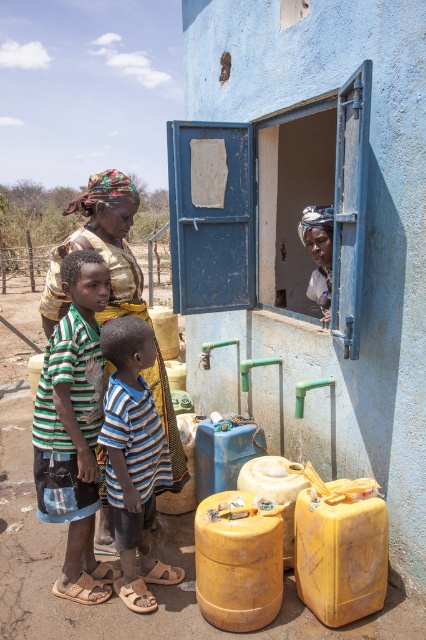
You are standing at the center of the image and want to locate the striped fabric shirt at lower left. In which direction should you look to find it?

The striped fabric shirt at lower left is located at coordinates (134, 458), so you should look to the lower left direction to find it.

You are a tailor observing two shirts in a shop window. The shirts are labeled as the striped cotton shirt at center and the striped fabric shirt at lower left. Which shirt is taller?

The striped cotton shirt at center is taller than the striped fabric shirt at lower left.

You are a photographer trying to capture both the striped fabric shirt at lower left and the matte yellow dress at center in a single shot. Based on their positions, which one should you focus on first to ensure both are in frame?

The striped fabric shirt at lower left is located below the matte yellow dress at center, so you should focus on the matte yellow dress at center first to ensure both are in frame.